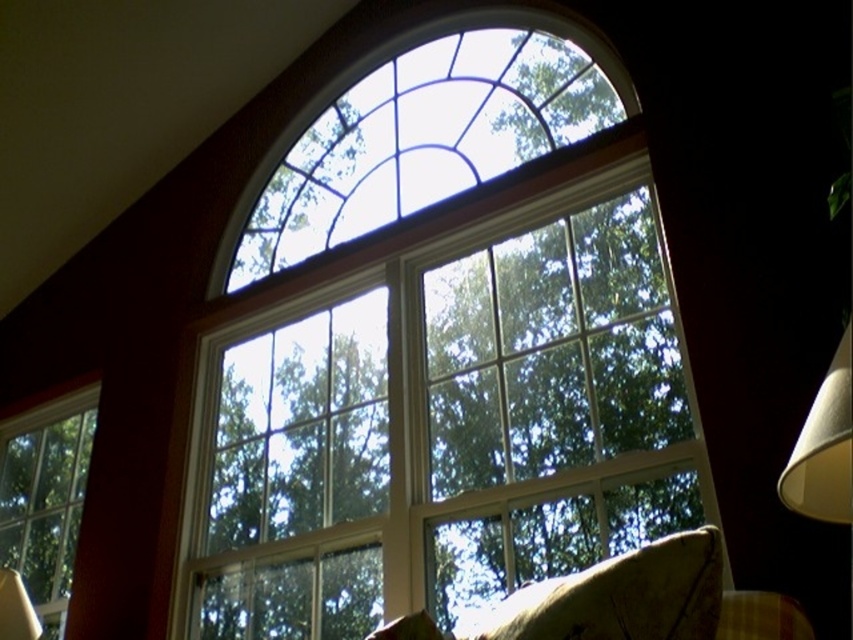
Can you confirm if clear glass window at center is bigger than patterned fabric pillow at lower right?

Yes, clear glass window at center is bigger than patterned fabric pillow at lower right.

This screenshot has height=640, width=853. Describe the element at coordinates (444, 420) in the screenshot. I see `clear glass window at center` at that location.

Locate an element on the screen. clear glass window at center is located at coordinates (444, 420).

Can you confirm if clear glass window at center is wider than white paper lampshade at right?

Yes, clear glass window at center is wider than white paper lampshade at right.

Who is more forward, (509, 529) or (833, 499)?

Point (833, 499) is more forward.

This screenshot has height=640, width=853. I want to click on clear glass window at center, so click(x=444, y=420).

This screenshot has width=853, height=640. I want to click on clear glass window at center, so click(x=444, y=420).

Between clear glass window at center and clear glass window at lower left, which one appears on the right side from the viewer's perspective?

clear glass window at center is more to the right.

The height and width of the screenshot is (640, 853). Describe the element at coordinates (444, 420) in the screenshot. I see `clear glass window at center` at that location.

Find the location of a particular element. Image resolution: width=853 pixels, height=640 pixels. clear glass window at center is located at coordinates (444, 420).